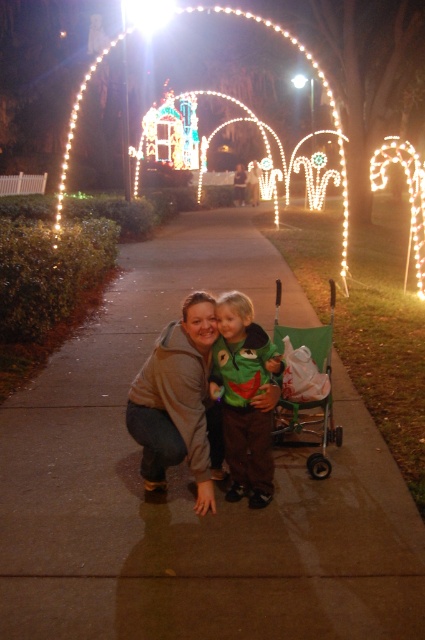
Question: Which object is farther from the camera taking this photo?

Choices:
 (A) green fuzzy sweater at center
 (B) illuminated wireframe arch at center
 (C) brown soft jacket at center

Answer: (B)

Question: Considering the real-world distances, which object is farthest from the brown soft jacket at center?

Choices:
 (A) green fuzzy sweater at center
 (B) brown concrete sidewalk at center
 (C) illuminated wireframe arch at center

Answer: (C)

Question: Where is green plastic baby carriage at lower right located in relation to illuminated wireframe arch at center in the image?

Choices:
 (A) right
 (B) left

Answer: (B)

Question: Which object appears closest to the camera in this image?

Choices:
 (A) green plastic baby carriage at lower right
 (B) green fuzzy sweater at center

Answer: (B)

Question: Is brown concrete sidewalk at center above illuminated wireframe arch at center?

Choices:
 (A) no
 (B) yes

Answer: (A)

Question: Can you confirm if green plastic baby carriage at lower right is wider than illuminated wireframe arch at center?

Choices:
 (A) yes
 (B) no

Answer: (B)